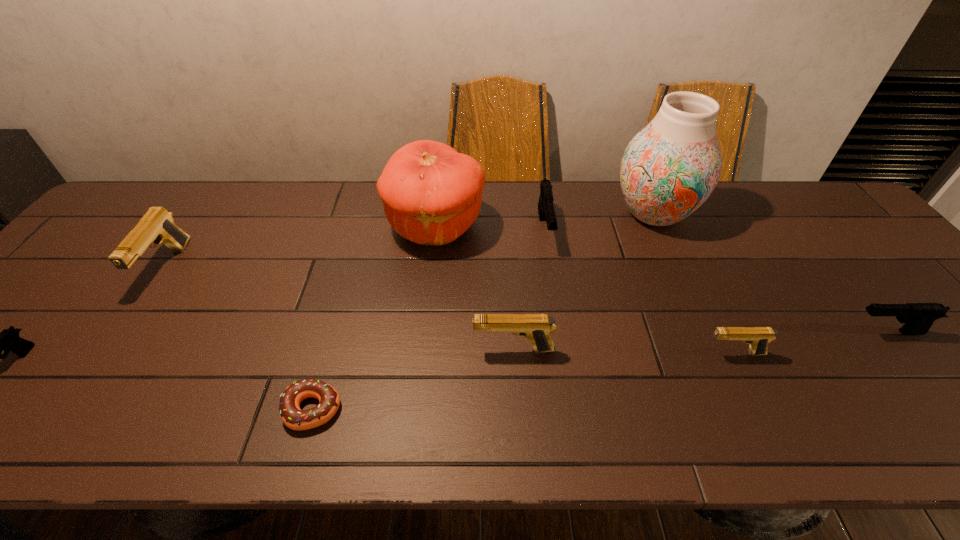
Find the location of a particular element. This screenshot has width=960, height=540. pistol that is at the far edge is located at coordinates pos(546,211).

You are a GUI agent. You are given a task and a screenshot of the screen. Output one action in this format:
    pyautogui.click(x=<x>, y=<y>)
    Task: Click on the object that is at the near edge
    
    Given the screenshot: What is the action you would take?
    pyautogui.click(x=293, y=417)

Where is `object situated at the right edge`? The height and width of the screenshot is (540, 960). object situated at the right edge is located at coordinates (917, 318).

Where is `vacant space at the far edge of the desktop`? The height and width of the screenshot is (540, 960). vacant space at the far edge of the desktop is located at coordinates (704, 206).

The width and height of the screenshot is (960, 540). In the image, there is a desktop. In order to click on vacant area at the near edge in this screenshot , I will do `click(522, 409)`.

Where is `vacant region at the far left corner`? This screenshot has width=960, height=540. vacant region at the far left corner is located at coordinates (172, 199).

Locate an element on the screen. The width and height of the screenshot is (960, 540). vacant space at the far right corner of the desktop is located at coordinates (824, 192).

You are a GUI agent. You are given a task and a screenshot of the screen. Output one action in this format:
    pyautogui.click(x=<x>, y=<y>)
    Task: Click on the unoccupied area between the fourth object from right to left and the fourth pistol from right to left
    
    Given the screenshot: What is the action you would take?
    pyautogui.click(x=529, y=289)

Locate an element on the screen. blank region between the farthest tan pistol and the smallest tan pistol is located at coordinates (x=450, y=310).

Locate an element on the screen. The height and width of the screenshot is (540, 960). empty space that is in between the second black pistol from right to left and the brown doughnut is located at coordinates coord(429,319).